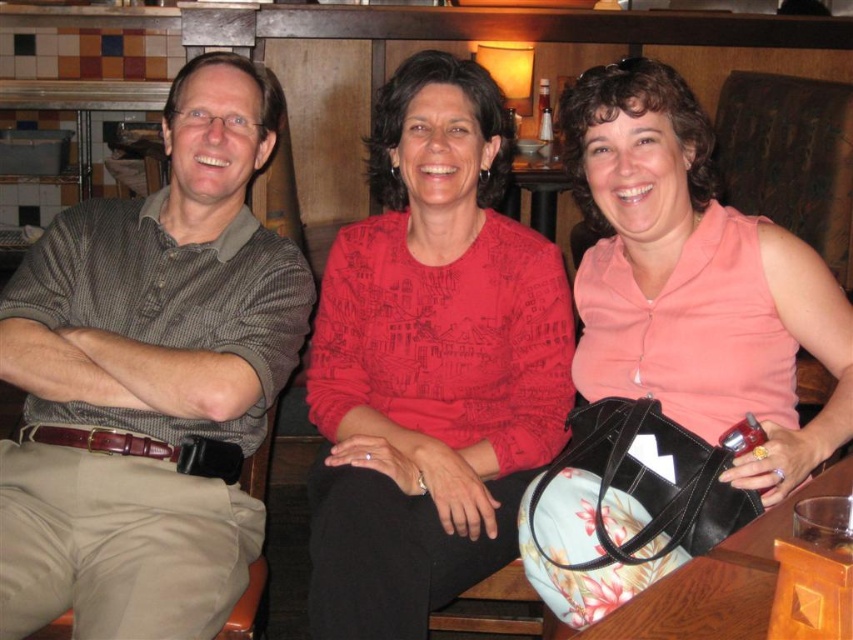
Which is above, pink fabric purse at center or wooden table at lower right?

pink fabric purse at center is above.

Between point (543, 588) and point (729, 540), which one is positioned in front?

Positioned in front is point (729, 540).

You are a GUI agent. You are given a task and a screenshot of the screen. Output one action in this format:
    pyautogui.click(x=<x>, y=<y>)
    Task: Click on the pink fabric purse at center
    The height and width of the screenshot is (640, 853).
    Given the screenshot: What is the action you would take?
    pyautogui.click(x=672, y=353)

At what (x,y) coordinates should I click in order to perform the action: click on pink fabric purse at center. Please return your answer as a coordinate pair (x, y). This screenshot has height=640, width=853. Looking at the image, I should click on (672, 353).

Looking at this image, does matte brown shirt at left appear on the right side of pink fabric purse at center?

No, matte brown shirt at left is not to the right of pink fabric purse at center.

Does matte brown shirt at left have a lesser width compared to pink fabric purse at center?

In fact, matte brown shirt at left might be wider than pink fabric purse at center.

Between point (146, 412) and point (646, 474), which one is positioned in front?

Positioned in front is point (646, 474).

The width and height of the screenshot is (853, 640). What are the coordinates of `matte brown shirt at left` in the screenshot? It's located at (148, 380).

Is matte brown shirt at left positioned at the back of wooden table at center?

No.

Is point (119, 212) more distant than point (561, 170)?

No, it is not.

At what (x,y) coordinates should I click in order to perform the action: click on matte brown shirt at left. Please return your answer as a coordinate pair (x, y). This screenshot has height=640, width=853. Looking at the image, I should click on (148, 380).